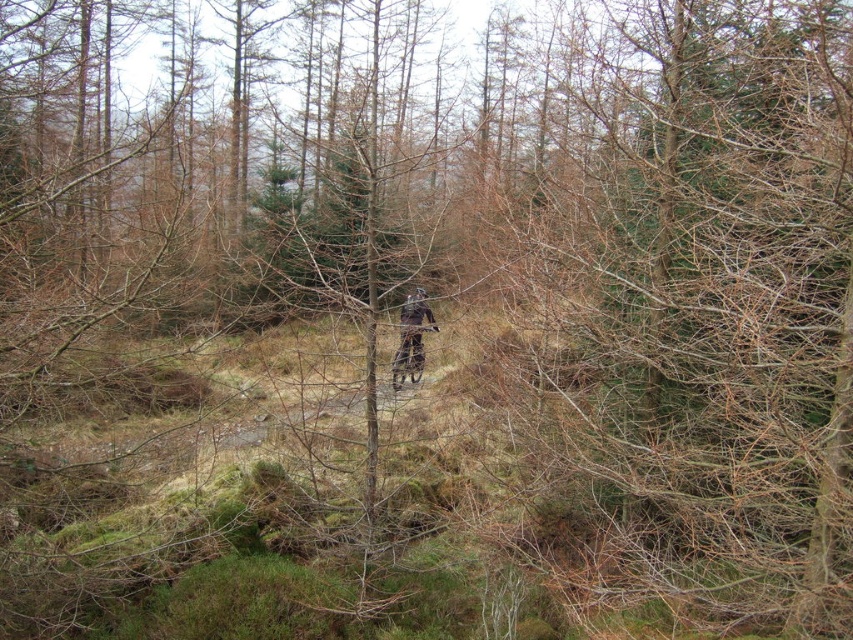
You are standing at the point marked as point (412, 330) in the forest scene. What item is located exactly at your current position?

The dark brown leather jacket at center is located exactly at point (412, 330).

You are a hiker trying to locate your friend who is wearing a dark brown leather jacket at center and riding a shiny metallic mountain bike at center. From your vantage point, which object would you see first?

The dark brown leather jacket at center is positioned over the shiny metallic mountain bike at center, so you would see the dark brown leather jacket at center first.

You are a hiker trying to take a photo of the shiny metallic mountain bike at center. There is a dark brown leather jacket at center blocking your view. Can you see the mountain bike clearly?

The dark brown leather jacket at center is in front of the shiny metallic mountain bike at center, so it is blocking the view of the mountain bike. You won